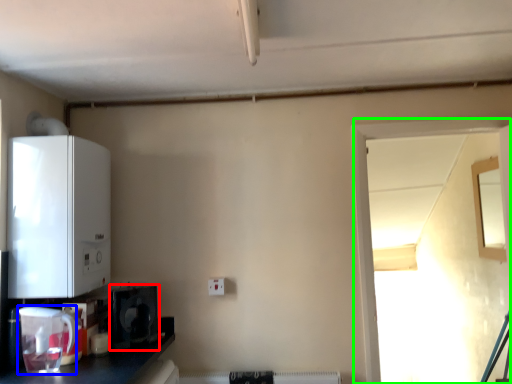
Question: Which is nearer to the appliance (highlighted by a red box)? appliance (highlighted by a blue box) or window (highlighted by a green box).

Choices:
 (A) appliance
 (B) window

Answer: (A)